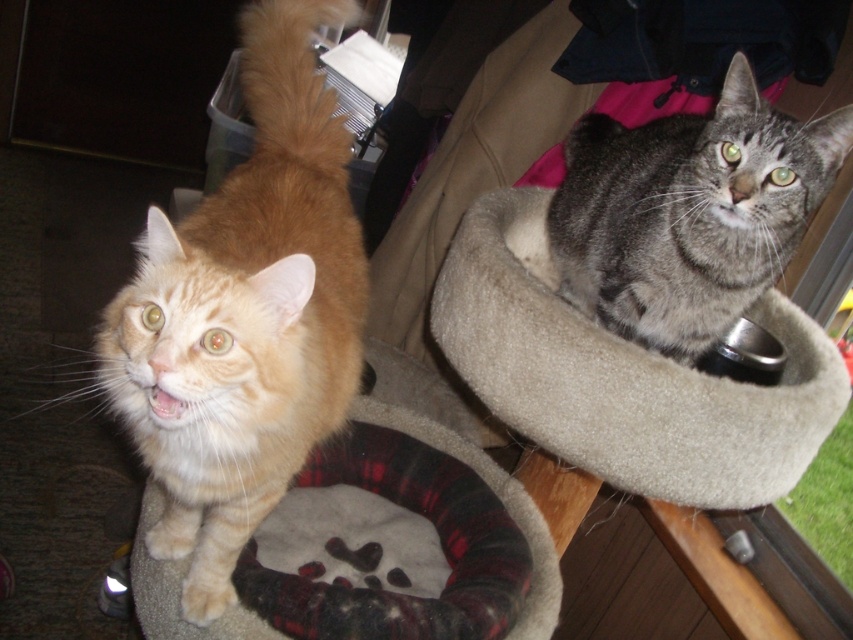
Consider the image. You are a cat owner who wants to place a new toy between the gray tabby cat at upper right and the orange cat with white markings on the left. Based on their positions, which cat is closer to you so that you can easily reach the toy?

The gray tabby cat at upper right is 90.93 centimeters from the viewer, so the gray tabby cat at upper right is closer to you than the orange cat with white markings on the left. Therefore, you can easily reach the toy placed near the gray tabby cat at upper right.

You are a cat owner trying to decide which pet bed to buy for your cats. You notice the gray tabby cat at upper right and the plaid fabric cat bed at center. Which one is more slender?

The gray tabby cat at upper right is thinner than the plaid fabric cat bed at center.

You are trying to place a new toy for the gray tabby cat at upper right. The toy requires a space that is at least as wide as the cat itself. Based on the scene, can the beige soft cat bed at upper right accommodate the toy?

The beige soft cat bed at upper right might be wider than gray tabby cat at upper right, so it could potentially accommodate the toy if the bed is indeed wider than the cat.